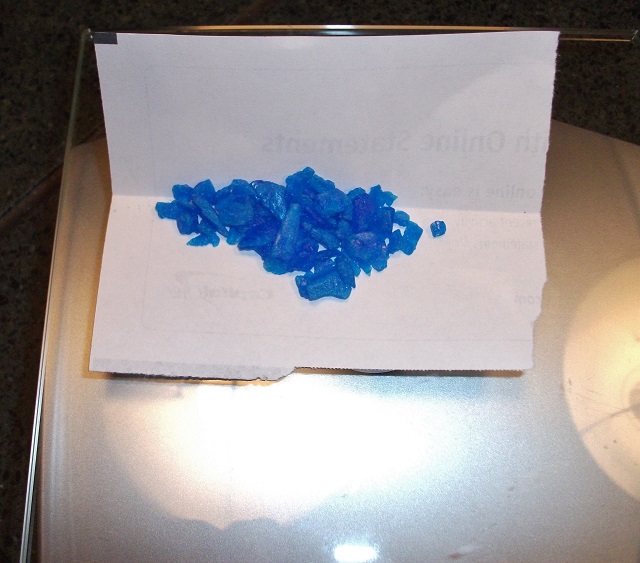
At what (x,y) coordinates should I click in order to perform the action: click on tabetop. Please return your answer as a coordinate pair (x, y). This screenshot has height=563, width=640. Looking at the image, I should click on (379, 455).